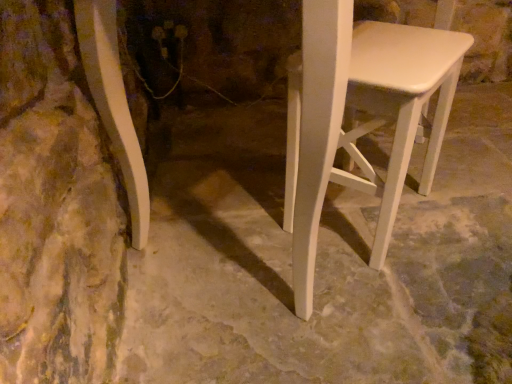
At what (x,y) coordinates should I click in order to perform the action: click on free spot to the right of white matte stool at right. Please return your answer as a coordinate pair (x, y). Looking at the image, I should click on (464, 208).